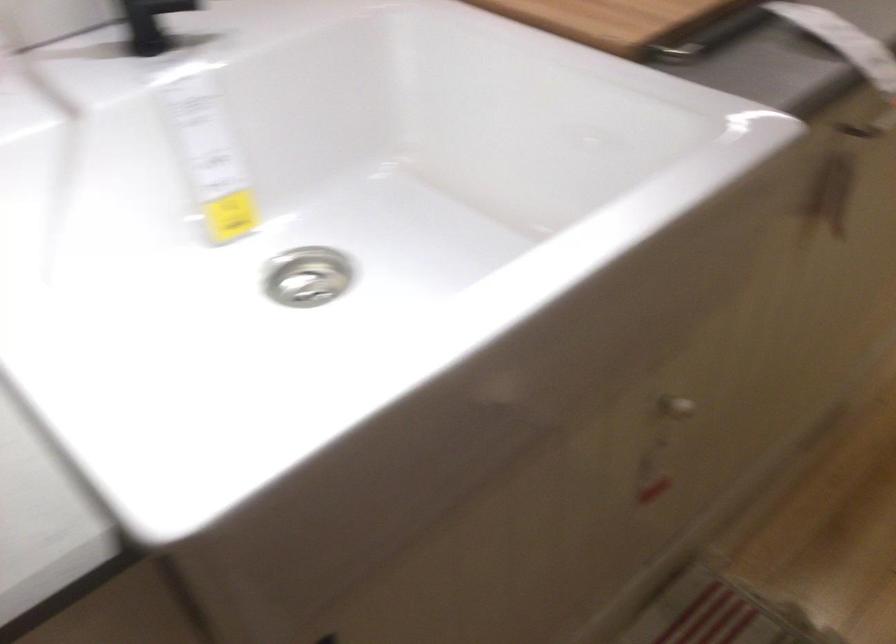
This screenshot has height=644, width=896. I want to click on cabinet knob, so click(x=675, y=408).